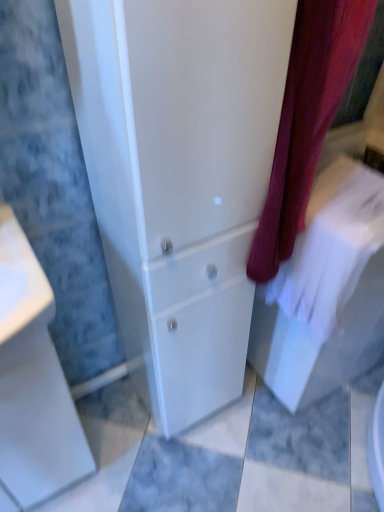
This screenshot has height=512, width=384. I want to click on free space that is in between white glossy porcelain at lower left and white glossy cabinet at center, so click(x=111, y=432).